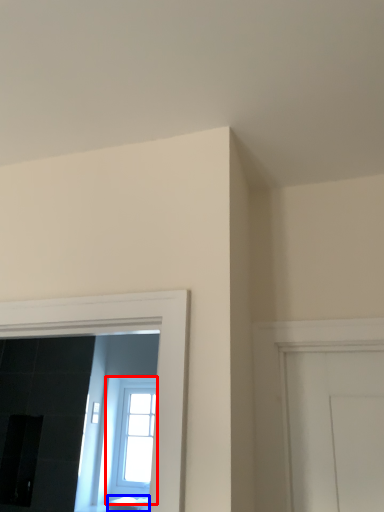
Question: Among these objects, which one is farthest to the camera, window (highlighted by a red box) or furniture (highlighted by a blue box)?

Choices:
 (A) window
 (B) furniture

Answer: (A)